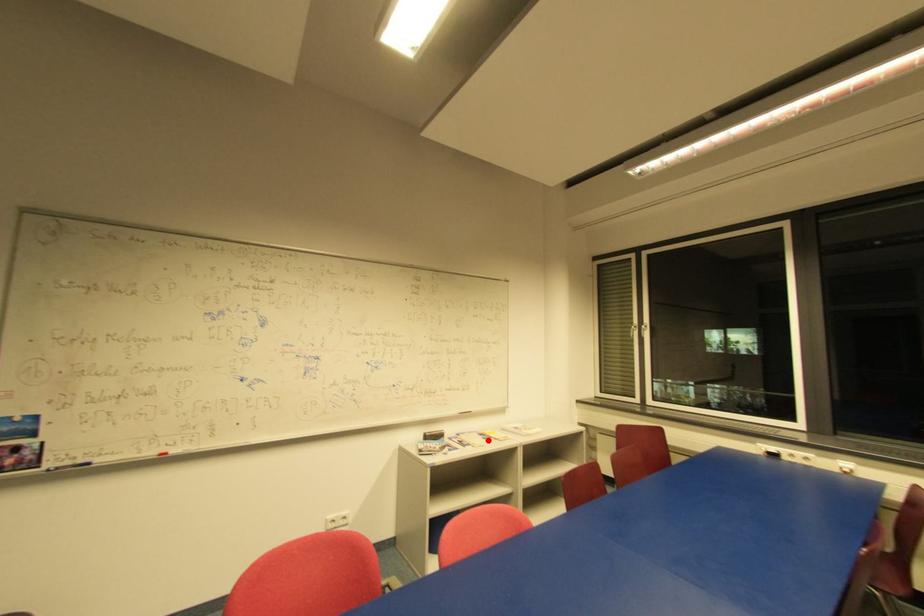
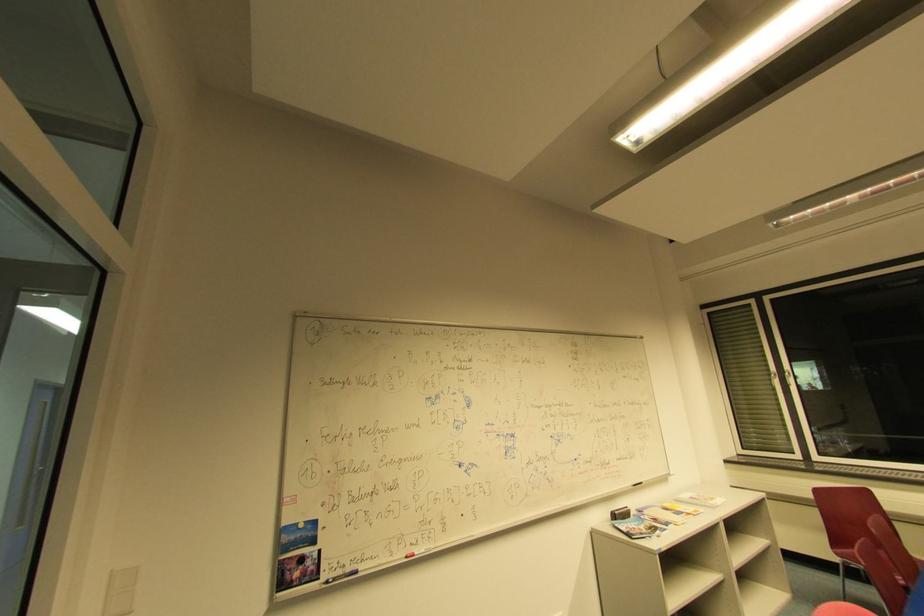
Find the pixel in the second image that matches the highlighted location in the first image.

(679, 515)